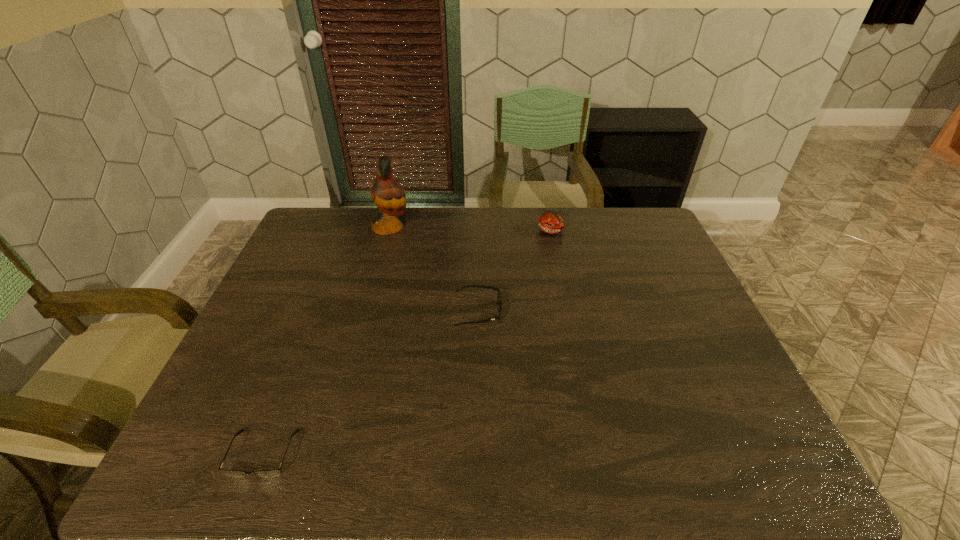
Find the location of a particular element. unoccupied position between the third tallest object and the tomato is located at coordinates (516, 271).

Where is `the second closest object to the third object from right to left`? This screenshot has width=960, height=540. the second closest object to the third object from right to left is located at coordinates (551, 222).

At what (x,y) coordinates should I click in order to perform the action: click on object that stands as the third closest to the second shortest object. Please return your answer as a coordinate pair (x, y). Looking at the image, I should click on (275, 472).

The height and width of the screenshot is (540, 960). Find the location of `blank space that satisfies the following two spatial constraints: 1. on the face of the second object from left to right; 2. on the front-facing side of the spectacles`. blank space that satisfies the following two spatial constraints: 1. on the face of the second object from left to right; 2. on the front-facing side of the spectacles is located at coordinates (330, 454).

At what (x,y) coordinates should I click in order to perform the action: click on blank area in the image that satisfies the following two spatial constraints: 1. on the face of the rightmost object; 2. on the right side of the third object from right to left. Please return your answer as a coordinate pair (x, y). The height and width of the screenshot is (540, 960). Looking at the image, I should click on (390, 231).

Find the location of a particular element. The image size is (960, 540). free location that satisfies the following two spatial constraints: 1. on the face of the tallest object; 2. on the right side of the tomato is located at coordinates (390, 231).

Identify the location of free region that satisfies the following two spatial constraints: 1. on the face of the second object from left to right; 2. on the front-facing side of the shortest object. (330, 454).

Locate an element on the screen. vacant space that satisfies the following two spatial constraints: 1. on the front side of the rightmost object; 2. on the front-facing side of the sunglasses is located at coordinates (569, 311).

Where is `vacant area in the image that satisfies the following two spatial constraints: 1. on the face of the tallest object; 2. on the front-facing side of the shortest object`? This screenshot has width=960, height=540. vacant area in the image that satisfies the following two spatial constraints: 1. on the face of the tallest object; 2. on the front-facing side of the shortest object is located at coordinates (330, 454).

Where is `vacant space that satisfies the following two spatial constraints: 1. on the face of the tomato; 2. on the right side of the parrot`? The width and height of the screenshot is (960, 540). vacant space that satisfies the following two spatial constraints: 1. on the face of the tomato; 2. on the right side of the parrot is located at coordinates (390, 231).